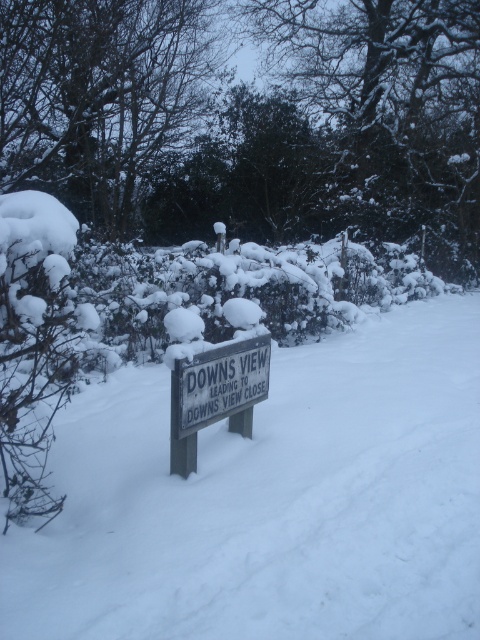
You are standing in front of the wooden signpost in the winter scene. There are two points marked on the signpost. One is at coordinate point (x=78, y=129) and the other is at point (x=175, y=458). Which point is closer to you?

Point (x=78, y=129) is further to the camera than point (x=175, y=458), so the point closer to you is point (x=175, y=458).